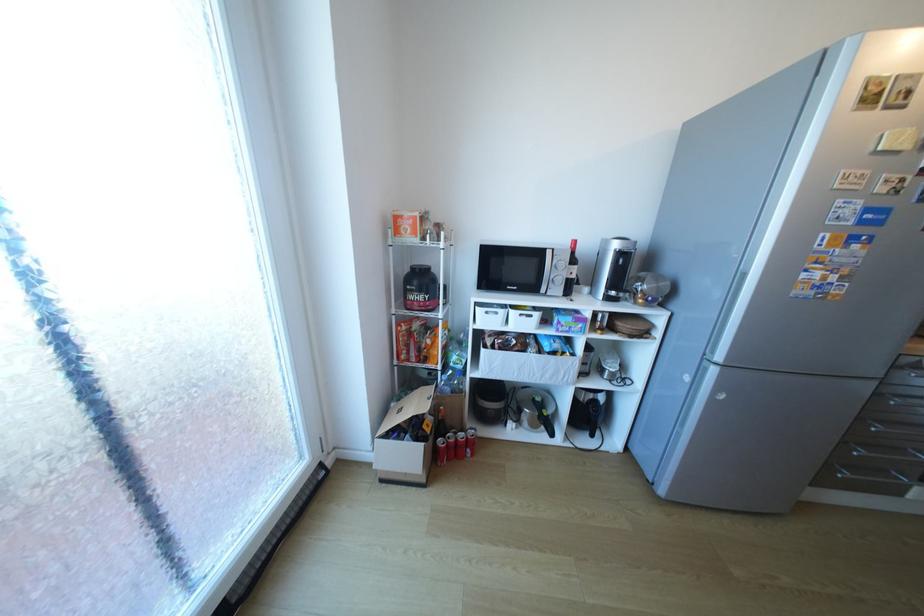
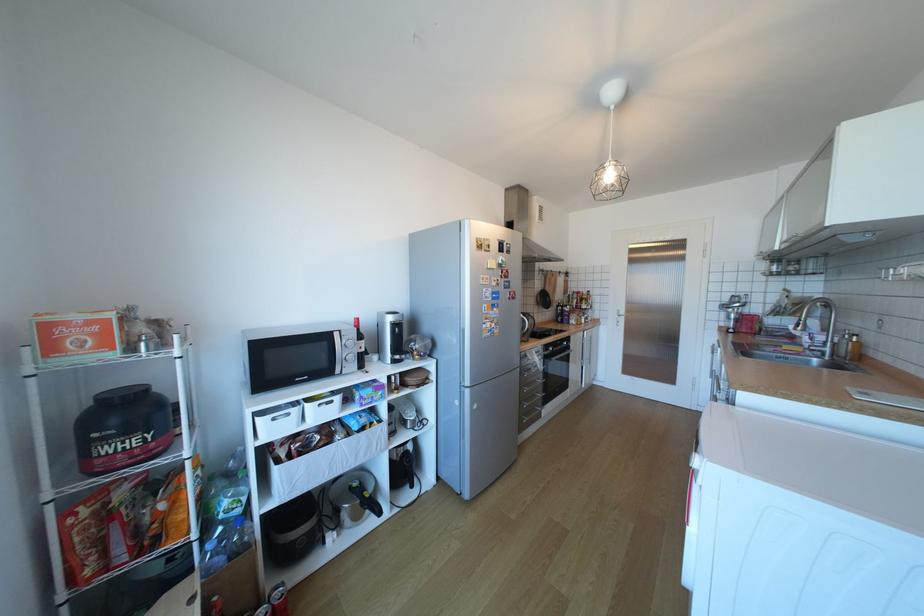
The point at (x=540, y=315) is marked in the first image. Where is the corresponding point in the second image?

(341, 402)